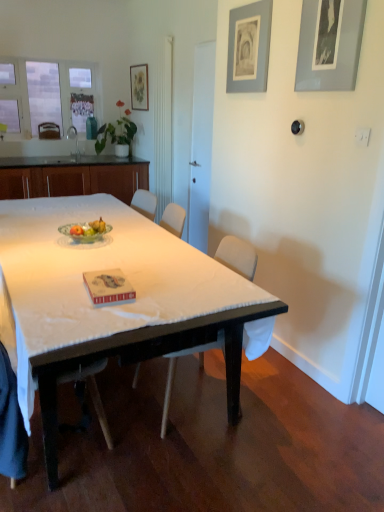
Question: Is point (49, 94) closer or farther from the camera than point (132, 79)?

Choices:
 (A) farther
 (B) closer

Answer: (A)

Question: Would you say clear glass window at upper left is to the left or to the right of matte floral print picture frame at upper center, marked as the 3th picture frame in a front-to-back arrangement, in the picture?

Choices:
 (A) right
 (B) left

Answer: (B)

Question: Which object is the farthest from the white wood chair at center, marked as the third chair in a back-to-front arrangement?

Choices:
 (A) green glass bowl at center
 (B) matte gray picture frame at upper right, which is the second picture frame from top to bottom
 (C) wooden at left, which ranks as the first chair in back-to-front order
 (D) wooden cabinet at left
 (E) matte floral print picture frame at upper center, the first picture frame from the top

Answer: (C)

Question: Estimate the real-world distances between objects in this image. Which object is farther from the white wood chair at center, the first chair from the bottom?

Choices:
 (A) matte floral print picture frame at upper center, which is the 3th picture frame in right-to-left order
 (B) wooden at left, positioned as the 3th chair in front-to-back order
 (C) wooden cabinet at left
 (D) clear glass window at upper left
 (E) matte gray picture frame at upper right, which appears as the second picture frame when viewed from the right

Answer: (D)